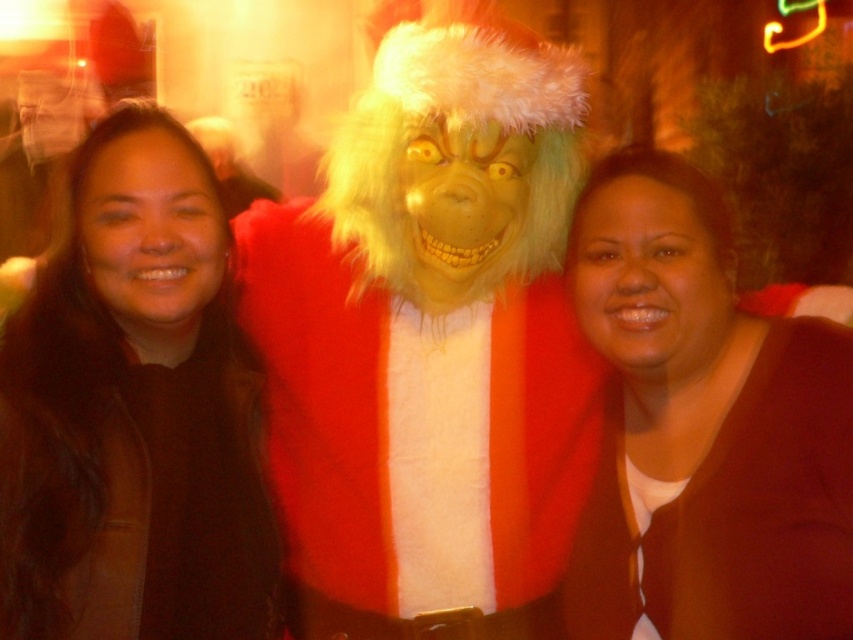
Question: Among these objects, which one is farthest from the camera?

Choices:
 (A) brown matte jacket at lower right
 (B) dark brown leather jacket at center
 (C) fuzzy red costume at center
 (D) fuzzy red coat at center

Answer: (C)

Question: Is fuzzy red coat at center bigger than brown matte jacket at lower right?

Choices:
 (A) no
 (B) yes

Answer: (B)

Question: Can you confirm if fuzzy red coat at center is thinner than dark brown leather jacket at center?

Choices:
 (A) yes
 (B) no

Answer: (B)

Question: Among these objects, which one is nearest to the camera?

Choices:
 (A) fuzzy red costume at center
 (B) brown matte jacket at lower right
 (C) dark brown leather jacket at center

Answer: (C)

Question: Can you confirm if fuzzy red coat at center is positioned below fuzzy red costume at center?

Choices:
 (A) no
 (B) yes

Answer: (B)

Question: Which of the following is the closest to the observer?

Choices:
 (A) (302, 259)
 (B) (235, 196)
 (C) (791, 481)

Answer: (C)